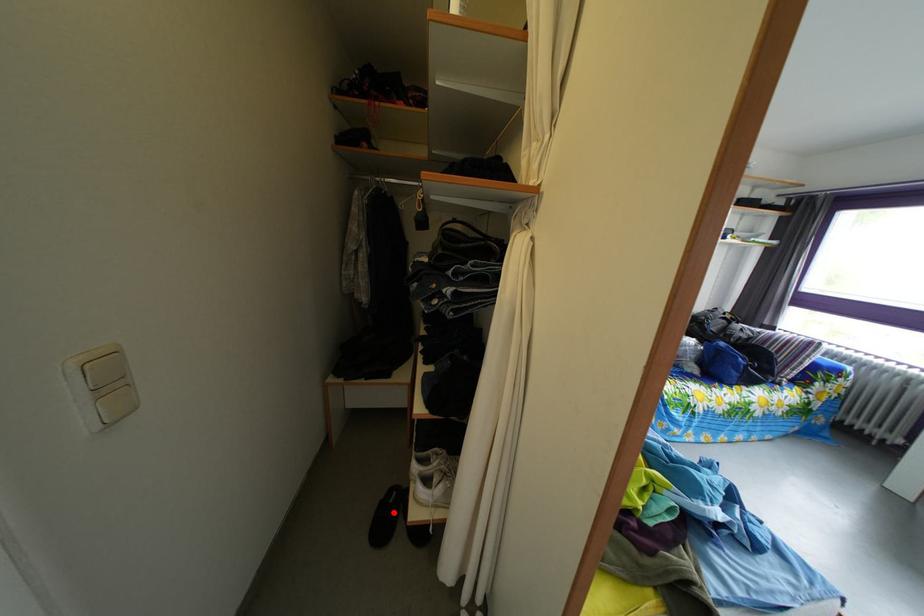
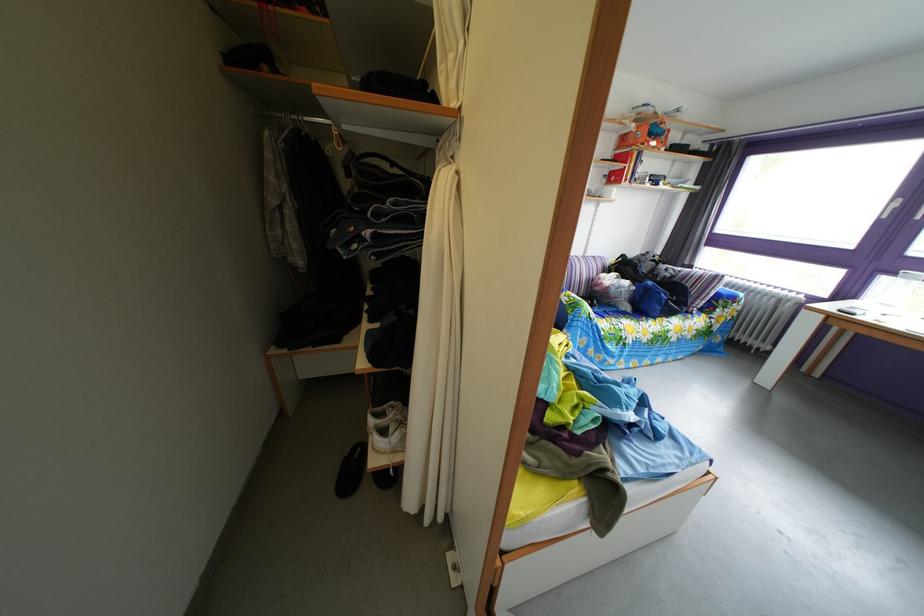
Question: I am providing you with two images of the same scene from different viewpoints. Given a red point in image1, look at the same physical point in image2. Is it:

Choices:
 (A) Closer to the viewpoint
 (B) Farther from the viewpoint

Answer: (B)